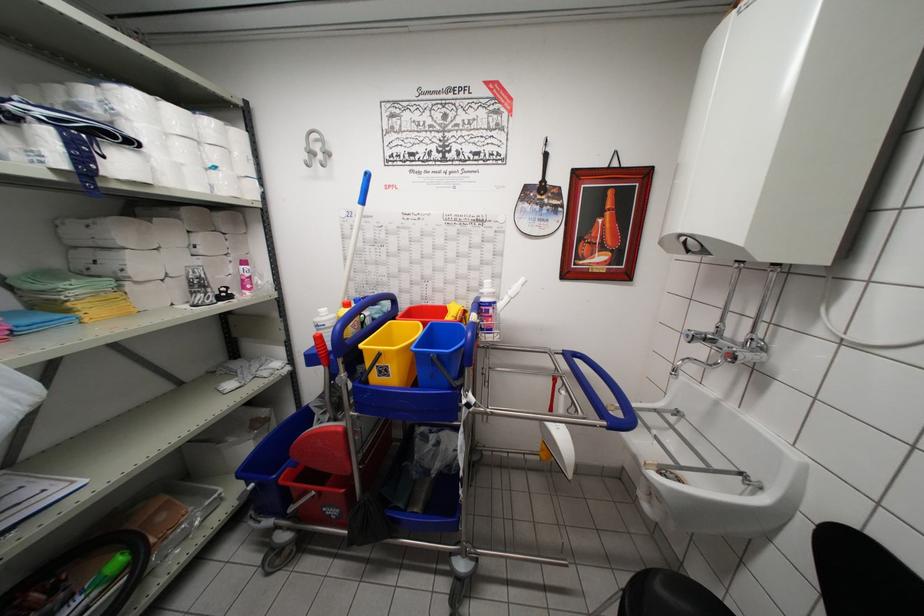
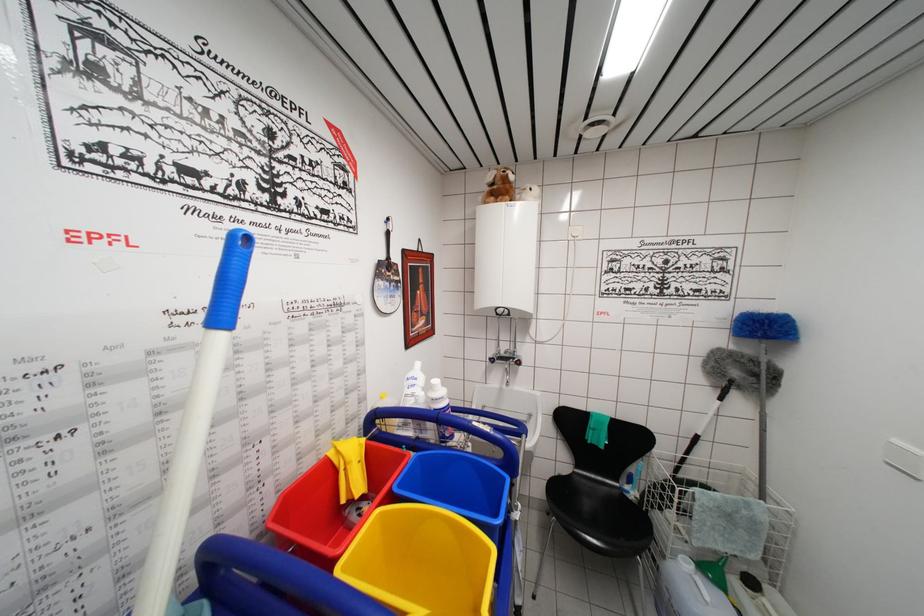
Question: The camera is either moving clockwise (left) or counter-clockwise (right) around the object. The first image is from the beginning of the video and the second image is from the end. Is the camera moving left or right when shooting the video?

Choices:
 (A) Left
 (B) Right

Answer: (A)